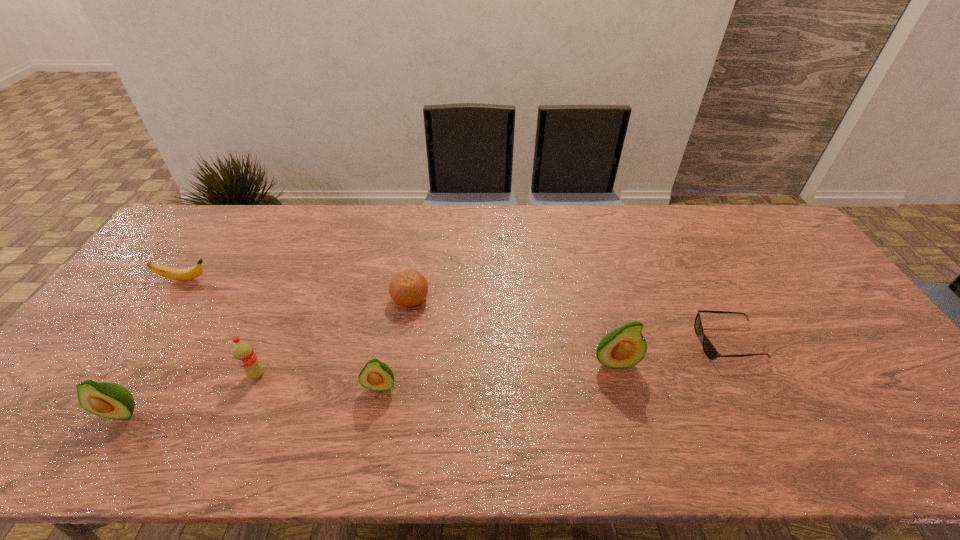
The width and height of the screenshot is (960, 540). I want to click on soda, so click(x=243, y=352).

Where is `vacant area situated 0.130m on the left of the sixth nearest object`? vacant area situated 0.130m on the left of the sixth nearest object is located at coordinates (347, 299).

At what (x,y) coordinates should I click in order to perform the action: click on free space located at the stem of the farthest object. Please return your answer as a coordinate pair (x, y). The width and height of the screenshot is (960, 540). Looking at the image, I should click on (327, 280).

The height and width of the screenshot is (540, 960). Find the location of `free space located on the lenses of the shortest object`. free space located on the lenses of the shortest object is located at coordinates (605, 342).

Where is `free space located on the lenses of the shortest object`? The height and width of the screenshot is (540, 960). free space located on the lenses of the shortest object is located at coordinates (560, 342).

Where is `vacant point located 0.210m on the lenses of the shortest object`? Image resolution: width=960 pixels, height=540 pixels. vacant point located 0.210m on the lenses of the shortest object is located at coordinates (620, 342).

Where is `free space located 0.090m on the right of the soda`? The image size is (960, 540). free space located 0.090m on the right of the soda is located at coordinates (301, 374).

The width and height of the screenshot is (960, 540). I want to click on avocado that is at the left edge, so click(108, 400).

In order to click on banana positioned at the left edge in this screenshot , I will do `click(187, 274)`.

Where is `object present at the near left corner`? The width and height of the screenshot is (960, 540). object present at the near left corner is located at coordinates (108, 400).